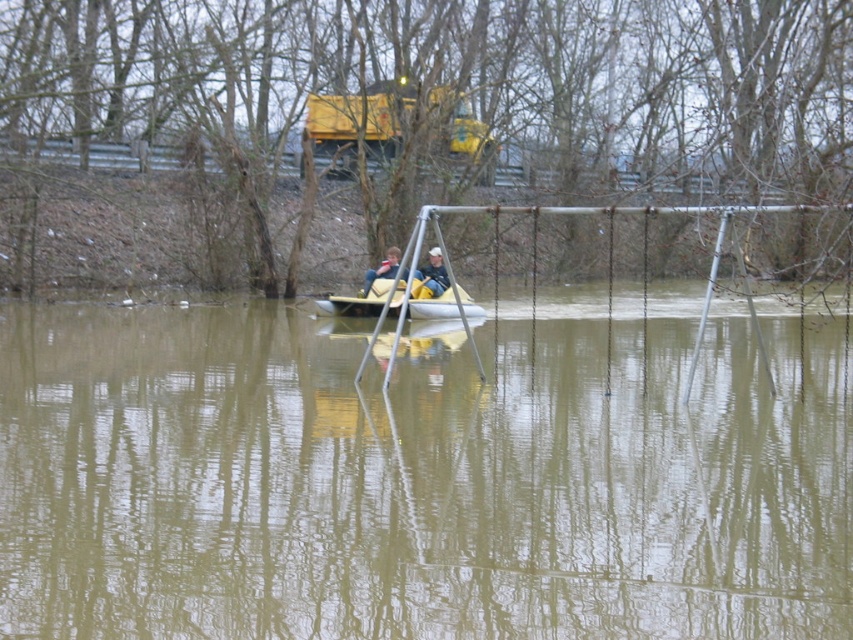
Question: Does brown murky water at center lie in front of matte yellow life jacket at center?

Choices:
 (A) no
 (B) yes

Answer: (B)

Question: Can you confirm if brown murky water at center is thinner than matte yellow life jacket at center?

Choices:
 (A) yes
 (B) no

Answer: (B)

Question: Does light blue denim jeans at center appear under matte yellow life jacket at center?

Choices:
 (A) no
 (B) yes

Answer: (A)

Question: Estimate the real-world distances between objects in this image. Which object is farther from the matte yellow life jacket at center?

Choices:
 (A) yellow rubber boat at center
 (B) brown murky water at center
 (C) light blue denim jeans at center

Answer: (B)

Question: Which object appears closest to the camera in this image?

Choices:
 (A) yellow rubber boat at center
 (B) brown murky water at center
 (C) matte yellow life jacket at center
 (D) light blue denim jeans at center

Answer: (B)

Question: Among these objects, which one is farthest from the camera?

Choices:
 (A) yellow rubber boat at center
 (B) light blue denim jeans at center

Answer: (B)